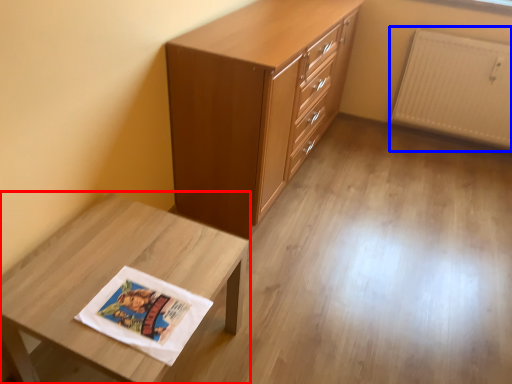
Question: Which object appears farthest to the camera in this image, table (highlighted by a red box) or radiator (highlighted by a blue box)?

Choices:
 (A) table
 (B) radiator

Answer: (B)